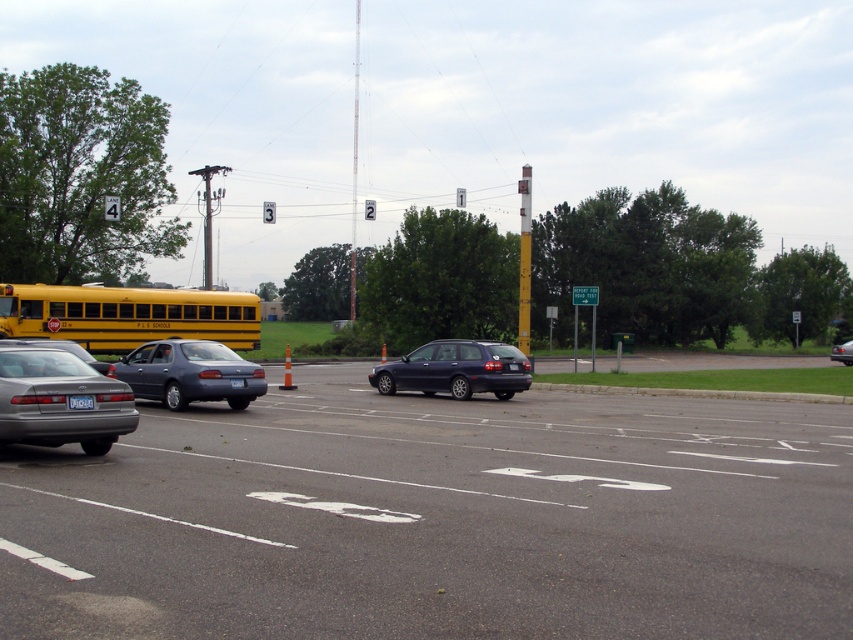
Question: Among these objects, which one is nearest to the camera?

Choices:
 (A) white plastic license plate at center
 (B) metallic silver sedan at center

Answer: (A)

Question: Observing the image, what is the correct spatial positioning of dark gray asphalt parking lot at lower left in reference to silver metallic sedan at left?

Choices:
 (A) left
 (B) right

Answer: (B)

Question: Which object appears closest to the camera in this image?

Choices:
 (A) matte gray sedan at center
 (B) dark gray asphalt parking lot at lower left
 (C) dark blue matte station wagon at center

Answer: (B)

Question: Which point is farther to the camera?

Choices:
 (A) (199, 394)
 (B) (55, 435)

Answer: (A)

Question: Is metallic silver sedan at center to the left of white plastic license plate at center from the viewer's perspective?

Choices:
 (A) no
 (B) yes

Answer: (A)

Question: Does dark blue matte station wagon at center appear on the right side of blue matte license plate at center?

Choices:
 (A) yes
 (B) no

Answer: (A)